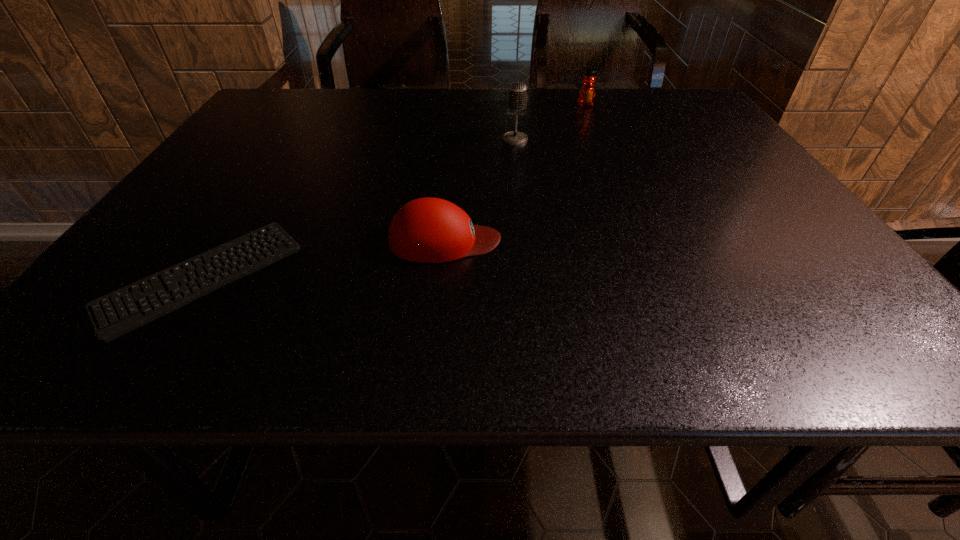
At what (x,y) coordinates should I click in order to perform the action: click on microphone. Please return your answer as a coordinate pair (x, y). Looking at the image, I should click on (517, 98).

This screenshot has height=540, width=960. I want to click on the tallest object, so click(517, 98).

Find the location of a particular element. The image size is (960, 540). the rightmost object is located at coordinates (587, 92).

The image size is (960, 540). What are the coordinates of `the farthest object` in the screenshot? It's located at (587, 92).

Locate an element on the screen. the third object from right to left is located at coordinates (428, 230).

Identify the location of computer keyboard. This screenshot has height=540, width=960. (164, 297).

Where is `the leftmost object`? the leftmost object is located at coordinates (164, 297).

I want to click on vacant space situated 0.320m on the front of the tallest object, so click(525, 221).

I want to click on vacant space located 0.150m on the front label of the honey, so click(596, 132).

Identify the location of free region located 0.300m on the front-facing side of the second object from left to right. (657, 241).